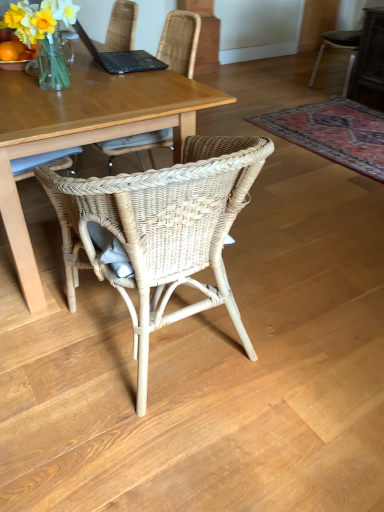
Question: From a real-world perspective, is translucent glass vase at upper left over dark gray fabric chair at upper right, acting as the first chair starting from the back?

Choices:
 (A) no
 (B) yes

Answer: (B)

Question: From the image's perspective, is translucent glass vase at upper left above dark gray fabric chair at upper right, marked as the second chair in a left-to-right arrangement?

Choices:
 (A) yes
 (B) no

Answer: (B)

Question: Is translucent glass vase at upper left thinner than dark gray fabric chair at upper right, acting as the 1th chair starting from the top?

Choices:
 (A) yes
 (B) no

Answer: (A)

Question: Is translucent glass vase at upper left positioned behind dark gray fabric chair at upper right, which ranks as the second chair in bottom-to-top order?

Choices:
 (A) no
 (B) yes

Answer: (A)

Question: Is translucent glass vase at upper left not inside dark gray fabric chair at upper right, marked as the second chair in a left-to-right arrangement?

Choices:
 (A) yes
 (B) no

Answer: (A)

Question: Based on their sizes in the image, would you say translucent glass vase at upper left is bigger or smaller than woven rattan chair at center, arranged as the 1th chair when ordered from the bottom?

Choices:
 (A) small
 (B) big

Answer: (A)

Question: Is translucent glass vase at upper left in front of or behind woven rattan chair at center, which is the first chair in left-to-right order, in the image?

Choices:
 (A) front
 (B) behind

Answer: (B)

Question: Do you think translucent glass vase at upper left is within woven rattan chair at center, marked as the 2th chair in a top-to-bottom arrangement, or outside of it?

Choices:
 (A) outside
 (B) inside

Answer: (A)

Question: From a real-world perspective, is translucent glass vase at upper left above or below woven rattan chair at center, arranged as the 1th chair when ordered from the bottom?

Choices:
 (A) below
 (B) above

Answer: (B)

Question: From the image's perspective, is dark gray fabric chair at upper right, which is the first chair in right-to-left order, above or below translucent glass vase at upper left?

Choices:
 (A) above
 (B) below

Answer: (A)

Question: Visually, is dark gray fabric chair at upper right, which is the first chair in right-to-left order, positioned to the left or to the right of translucent glass vase at upper left?

Choices:
 (A) right
 (B) left

Answer: (A)

Question: Considering the positions of point (382, 53) and point (74, 7), is point (382, 53) closer or farther from the camera than point (74, 7)?

Choices:
 (A) farther
 (B) closer

Answer: (A)

Question: Is dark gray fabric chair at upper right, acting as the first chair starting from the back, in front of or behind translucent glass vase at upper left in the image?

Choices:
 (A) front
 (B) behind

Answer: (B)

Question: Which is correct: dark gray fabric chair at upper right, the 2th chair viewed from the front, is inside carpet with intricate pattern at lower right, or outside of it?

Choices:
 (A) inside
 (B) outside

Answer: (B)

Question: Would you say dark gray fabric chair at upper right, marked as the second chair in a left-to-right arrangement, is to the left or to the right of carpet with intricate pattern at lower right in the picture?

Choices:
 (A) right
 (B) left

Answer: (A)